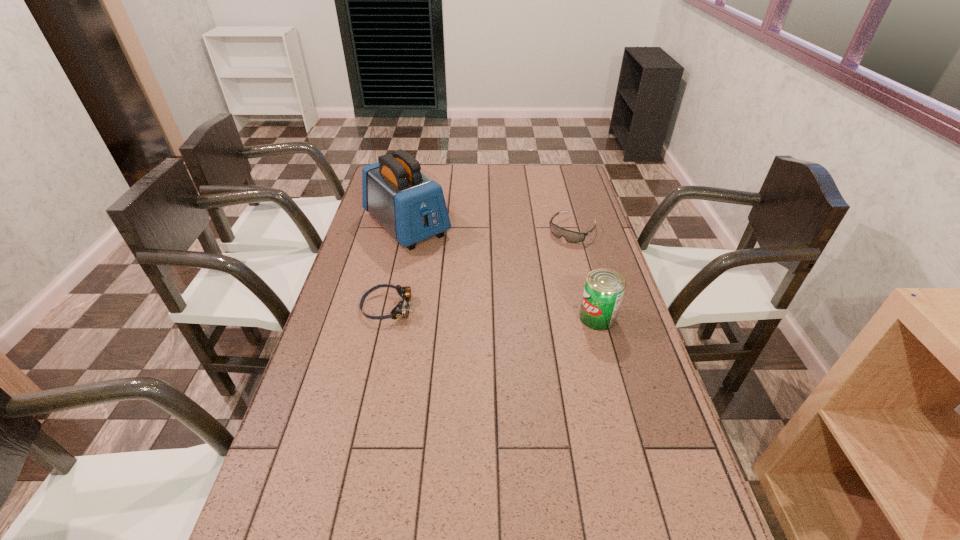
The width and height of the screenshot is (960, 540). I want to click on free space located on the front-facing side of the toaster, so click(499, 312).

Where is `goggles present at the left edge`? This screenshot has height=540, width=960. goggles present at the left edge is located at coordinates (402, 309).

Locate an element on the screen. The image size is (960, 540). toaster situated at the left edge is located at coordinates (411, 206).

Identify the location of can that is at the right edge. This screenshot has height=540, width=960. (604, 288).

Identify the location of goggles present at the right edge. (570, 236).

In the image, there is a desktop. Identify the location of vacant space at the far edge. The width and height of the screenshot is (960, 540). (474, 166).

The image size is (960, 540). I want to click on free space at the near edge, so click(481, 502).

Identify the location of vacant region at the left edge. The image size is (960, 540). (373, 260).

At what (x,y) coordinates should I click in order to perform the action: click on blank space at the right edge of the desktop. Please return your answer as a coordinate pair (x, y). Looking at the image, I should click on (565, 191).

Image resolution: width=960 pixels, height=540 pixels. What are the coordinates of `vacant space at the far right corner` in the screenshot? It's located at (555, 179).